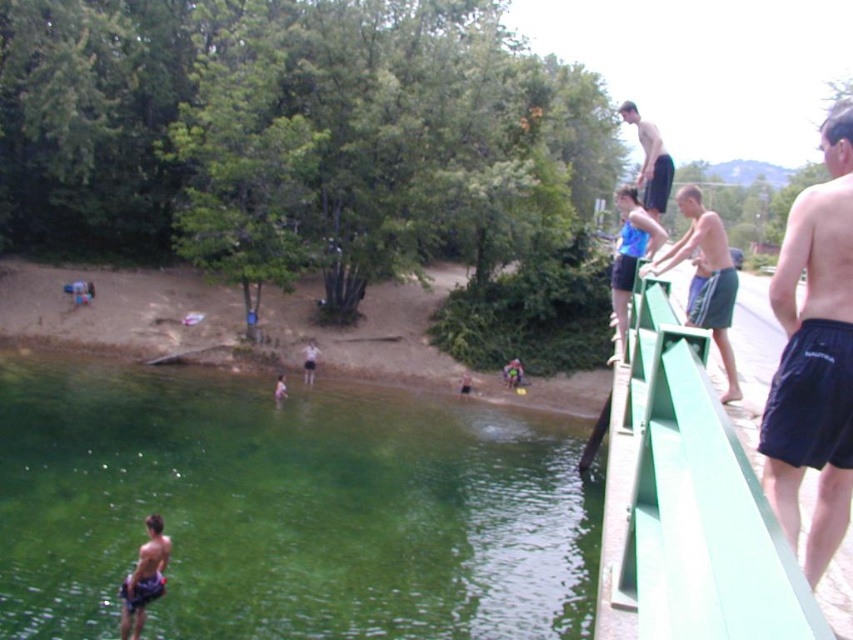
Question: Which object is the closest to the smooth skin child at lower left?

Choices:
 (A) smooth black shorts at upper right
 (B) black fabric shorts at right
 (C) blue fabric shorts at upper right
 (D) green translucent water at lower left

Answer: (D)

Question: Is green translucent water at lower left wider than smooth skin child at lower left?

Choices:
 (A) no
 (B) yes

Answer: (B)

Question: Can you confirm if black fabric shorts at right is positioned to the left of smooth black shorts at upper right?

Choices:
 (A) no
 (B) yes

Answer: (B)

Question: Does black fabric shorts at right lie in front of blue fabric shorts at upper right?

Choices:
 (A) yes
 (B) no

Answer: (A)

Question: Estimate the real-world distances between objects in this image. Which object is closer to the black fabric shorts at right?

Choices:
 (A) smooth skin child at lower left
 (B) blue fabric shorts at upper right
 (C) green translucent water at lower left

Answer: (B)

Question: Which object appears closest to the camera in this image?

Choices:
 (A) smooth skin child at lower left
 (B) smooth black shorts at upper right

Answer: (A)